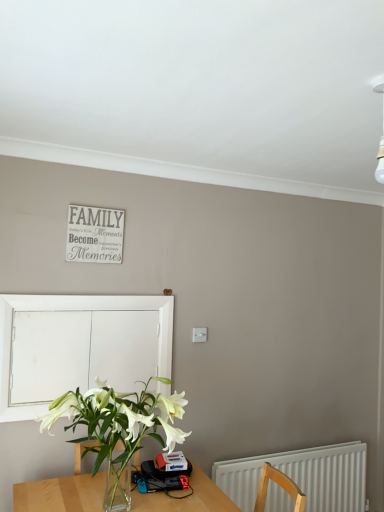
Question: Is white matte window screen at left surrounding white matte signboard at upper center?

Choices:
 (A) no
 (B) yes

Answer: (A)

Question: Is white matte window screen at left turned away from white matte signboard at upper center?

Choices:
 (A) no
 (B) yes

Answer: (A)

Question: Does white matte window screen at left have a greater width compared to white matte signboard at upper center?

Choices:
 (A) yes
 (B) no

Answer: (A)

Question: Would you consider white matte window screen at left to be distant from white matte signboard at upper center?

Choices:
 (A) no
 (B) yes

Answer: (A)

Question: From a real-world perspective, is white matte window screen at left physically below white matte signboard at upper center?

Choices:
 (A) yes
 (B) no

Answer: (A)

Question: Looking at the image, does white matte window screen at left seem bigger or smaller compared to white plastic radiator at lower right?

Choices:
 (A) small
 (B) big

Answer: (A)

Question: Is white matte window screen at left taller or shorter than white plastic radiator at lower right?

Choices:
 (A) tall
 (B) short

Answer: (A)

Question: Choose the correct answer: Is white matte window screen at left inside white plastic radiator at lower right or outside it?

Choices:
 (A) inside
 (B) outside

Answer: (B)

Question: From a real-world perspective, is white matte window screen at left physically located above or below white plastic radiator at lower right?

Choices:
 (A) above
 (B) below

Answer: (A)

Question: Is white plastic radiator at lower right taller or shorter than white matte window screen at left?

Choices:
 (A) short
 (B) tall

Answer: (A)

Question: From a real-world perspective, relative to white matte window screen at left, is white plastic radiator at lower right vertically above or below?

Choices:
 (A) below
 (B) above

Answer: (A)

Question: From the image's perspective, is white plastic radiator at lower right located above or below white matte window screen at left?

Choices:
 (A) below
 (B) above

Answer: (A)

Question: Is white plastic radiator at lower right inside the boundaries of white matte window screen at left, or outside?

Choices:
 (A) outside
 (B) inside

Answer: (A)

Question: Based on their positions, is white matte signboard at upper center located to the left or right of white plastic radiator at lower right?

Choices:
 (A) right
 (B) left

Answer: (B)

Question: Does point (104, 252) appear closer or farther from the camera than point (347, 478)?

Choices:
 (A) closer
 (B) farther

Answer: (A)